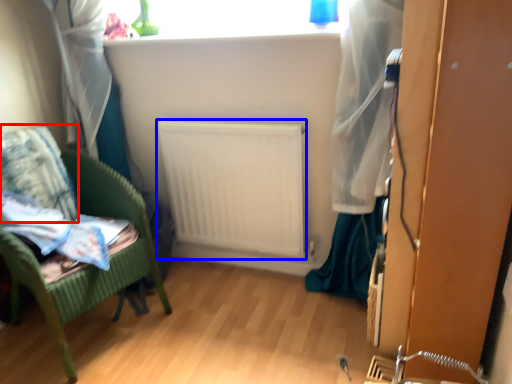
Question: Among these objects, which one is farthest to the camera, pillow (highlighted by a red box) or radiator (highlighted by a blue box)?

Choices:
 (A) pillow
 (B) radiator

Answer: (B)